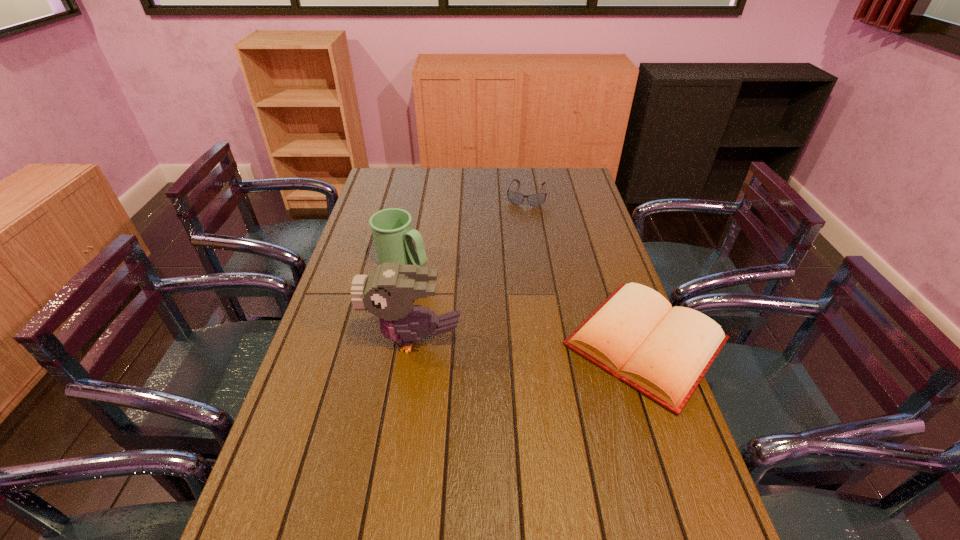
In the image, there is a desktop. Where is `vacant area at the near edge`? vacant area at the near edge is located at coordinates (423, 535).

This screenshot has width=960, height=540. In order to click on vacant region at the left edge of the desktop in this screenshot , I will do `click(362, 323)`.

This screenshot has width=960, height=540. What are the coordinates of `vacant region at the right edge of the desktop` in the screenshot? It's located at pyautogui.click(x=588, y=215).

Image resolution: width=960 pixels, height=540 pixels. In the image, there is a desktop. Find the location of `free region at the far left corner`. free region at the far left corner is located at coordinates (408, 192).

Locate an element on the screen. The image size is (960, 540). vacant space at the near left corner of the desktop is located at coordinates (277, 531).

Identify the location of free space at the far right corner of the desktop. (562, 176).

The image size is (960, 540). Identify the location of vacant area that lies between the Bible and the third shortest object. (524, 302).

At what (x,y) coordinates should I click in order to perform the action: click on free space between the bird and the sunglasses. Please return your answer as a coordinate pair (x, y). Image resolution: width=960 pixels, height=540 pixels. Looking at the image, I should click on (470, 267).

Where is `empty space that is in between the farthest object and the mug`? Image resolution: width=960 pixels, height=540 pixels. empty space that is in between the farthest object and the mug is located at coordinates (465, 228).

Identify the location of vacant space that is in between the farthest object and the third shortest object. (465, 228).